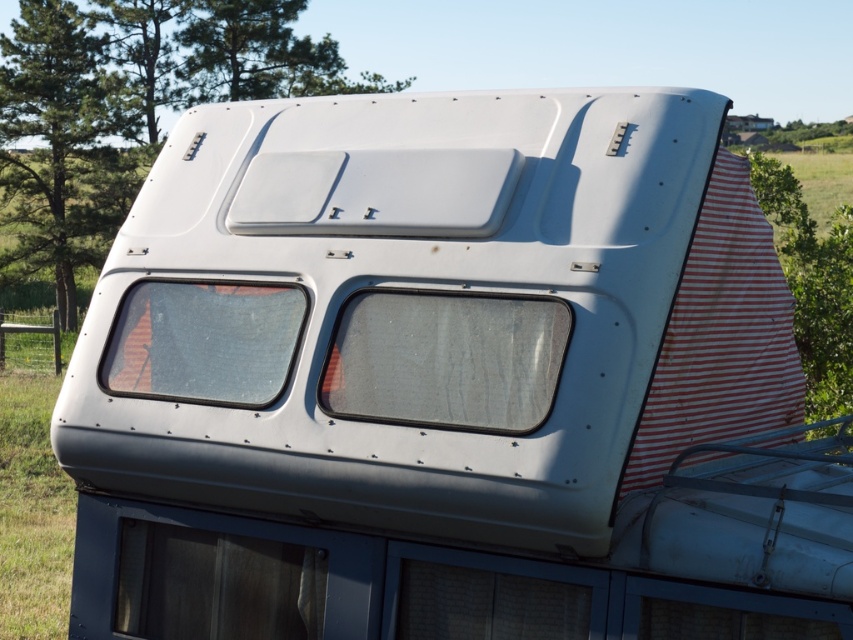
Between wooden panel at lower left and transparent glass window at lower left, which one is positioned higher?

Positioned higher is transparent glass window at lower left.

Is wooden panel at lower left smaller than transparent glass window at lower left?

Yes, wooden panel at lower left is smaller than transparent glass window at lower left.

The width and height of the screenshot is (853, 640). What do you see at coordinates (216, 584) in the screenshot?
I see `wooden panel at lower left` at bounding box center [216, 584].

Find the location of a particular element. The image size is (853, 640). wooden panel at lower left is located at coordinates (216, 584).

Is transparent glass window at center to the right of transparent glass window at lower left from the viewer's perspective?

Correct, you'll find transparent glass window at center to the right of transparent glass window at lower left.

Which is behind, point (352, 339) or point (166, 282)?

Positioned behind is point (166, 282).

This screenshot has height=640, width=853. What are the coordinates of `transparent glass window at center` in the screenshot? It's located at (445, 358).

Based on the photo, who is positioned more to the right, transparent glass window at center or wooden panel at lower left?

transparent glass window at center is more to the right.

Does transparent glass window at center have a greater height compared to wooden panel at lower left?

Yes, transparent glass window at center is taller than wooden panel at lower left.

Is point (424, 372) farther from viewer compared to point (306, 627)?

No, (424, 372) is closer to viewer.

The height and width of the screenshot is (640, 853). Find the location of `transparent glass window at center`. transparent glass window at center is located at coordinates (445, 358).